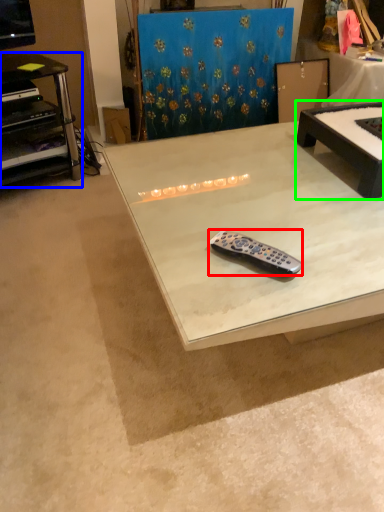
Question: Which object is positioned closest to remote control (highlighted by a red box)? Select from desk (highlighted by a blue box) and table (highlighted by a green box).

Choices:
 (A) desk
 (B) table

Answer: (B)